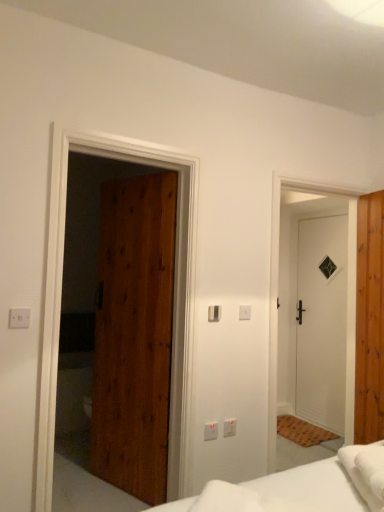
Question: Is white soft bed at lower center to the left or to the right of white plastic electric outlet at center, the first electric outlet ordered from the bottom, in the image?

Choices:
 (A) left
 (B) right

Answer: (A)

Question: Is white soft bed at lower center spatially inside white plastic electric outlet at center, placed as the first electric outlet when sorted from right to left, or outside of it?

Choices:
 (A) inside
 (B) outside

Answer: (B)

Question: Based on their relative distances, which object is nearer to the white plastic electric outlet at center, the 2th electric outlet from the front?

Choices:
 (A) white plastic light switch at center, placed as the first light switch when sorted from back to front
 (B) wooden door at left, the third door in the back-to-front sequence
 (C) satin silver switch at center, which is counted as the second light switch, starting from the front
 (D) wooden door at right, acting as the second door starting from the back
 (E) white matte door at right, the 1th door when ordered from back to front

Answer: (C)

Question: Which is nearer to the white plastic electric outlet at left, the first electric outlet in the top-to-bottom sequence?

Choices:
 (A) white soft bedsheet at lower right
 (B) white matte door at right, which is counted as the second door, starting from the right
 (C) white plastic electric outlet at center, the first electric outlet ordered from the bottom
 (D) wooden door at left, which ranks as the 3th door in right-to-left order
 (E) white soft bed at lower center

Answer: (D)